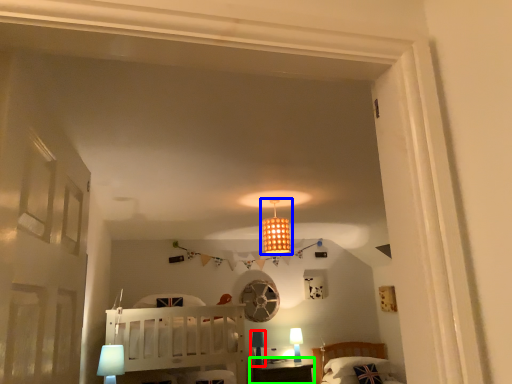
Question: Considering the real-world distances, which object is farthest from table lamp (highlighted by a red box)? lamp (highlighted by a blue box) or table (highlighted by a green box)?

Choices:
 (A) lamp
 (B) table

Answer: (A)